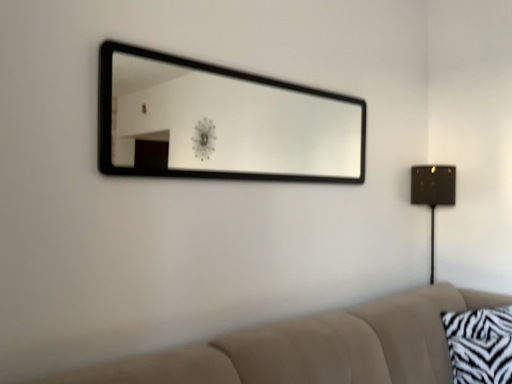
Question: Considering the relative positions of black frame mirror at upper center and zebra-patterned fabric pillow at lower right in the image provided, is black frame mirror at upper center behind zebra-patterned fabric pillow at lower right?

Choices:
 (A) yes
 (B) no

Answer: (B)

Question: Is black frame mirror at upper center shorter than zebra-patterned fabric pillow at lower right?

Choices:
 (A) no
 (B) yes

Answer: (A)

Question: Is black frame mirror at upper center oriented towards zebra-patterned fabric pillow at lower right?

Choices:
 (A) no
 (B) yes

Answer: (A)

Question: Can you confirm if black frame mirror at upper center is positioned to the right of zebra-patterned fabric pillow at lower right?

Choices:
 (A) yes
 (B) no

Answer: (B)

Question: Is zebra-patterned fabric pillow at lower right a part of black frame mirror at upper center?

Choices:
 (A) no
 (B) yes

Answer: (A)

Question: Is black frame mirror at upper center wider than zebra-patterned fabric pillow at lower right?

Choices:
 (A) no
 (B) yes

Answer: (A)

Question: Is zebra-patterned fabric pillow at lower right at the back of metallic gold table lamp at right?

Choices:
 (A) yes
 (B) no

Answer: (B)

Question: Does metallic gold table lamp at right turn towards zebra-patterned fabric pillow at lower right?

Choices:
 (A) no
 (B) yes

Answer: (A)

Question: Is metallic gold table lamp at right to the left of zebra-patterned fabric pillow at lower right from the viewer's perspective?

Choices:
 (A) yes
 (B) no

Answer: (B)

Question: Can you confirm if metallic gold table lamp at right is smaller than zebra-patterned fabric pillow at lower right?

Choices:
 (A) no
 (B) yes

Answer: (A)

Question: Is metallic gold table lamp at right not inside zebra-patterned fabric pillow at lower right?

Choices:
 (A) yes
 (B) no

Answer: (A)

Question: Considering the relative sizes of metallic gold table lamp at right and zebra-patterned fabric pillow at lower right in the image provided, is metallic gold table lamp at right bigger than zebra-patterned fabric pillow at lower right?

Choices:
 (A) yes
 (B) no

Answer: (A)

Question: Is beige fabric couch at lower right positioned in front of zebra-patterned fabric pillow at lower right?

Choices:
 (A) no
 (B) yes

Answer: (B)